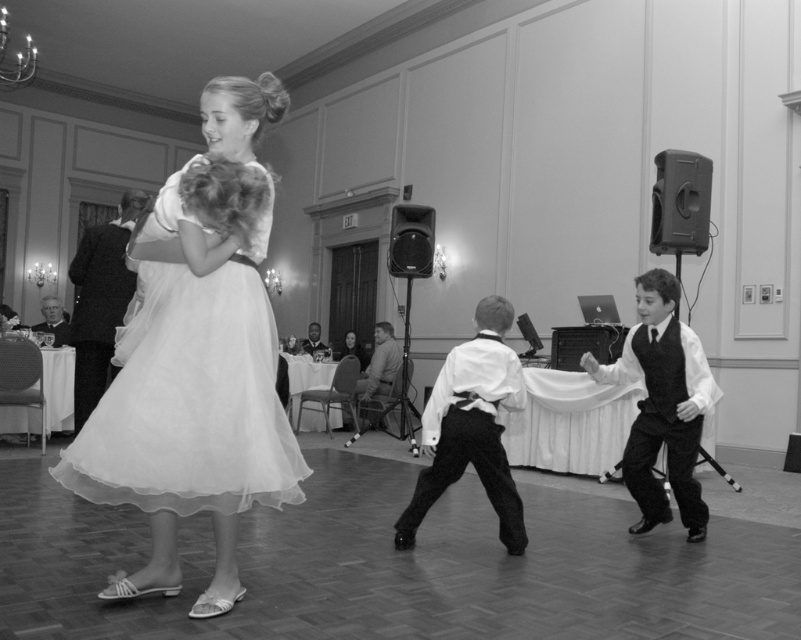
You are a photographer at the event and want to ensure both the matte white dress at center and the white satin shirt at center are clearly visible in your photo. Given their sizes, which one might you need to adjust your focus on more carefully to ensure it doesn

The matte white dress at center is larger in size than the white satin shirt at center, so you may need to focus more carefully on the white satin shirt at center to ensure its details are captured clearly since it is smaller and might be harder to see.

You are a photographer at the event and need to adjust the lighting between the white satin shirt at center and the metallic black speaker at center. How far apart are these two objects?

The white satin shirt at center is 3.56 meters away from the metallic black speaker at center.